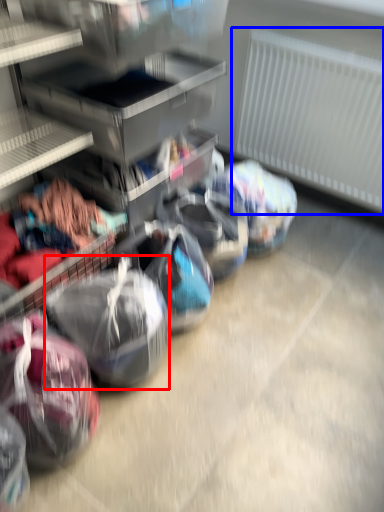
Question: Which of the following is the farthest to the observer, sack (highlighted by a red box) or radiator (highlighted by a blue box)?

Choices:
 (A) sack
 (B) radiator

Answer: (B)